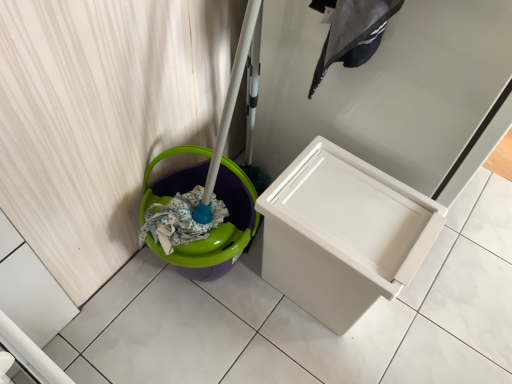
Question: Is white plastic drawer at center to the right of white plastic waste container at center from the viewer's perspective?

Choices:
 (A) yes
 (B) no

Answer: (A)

Question: Is white plastic drawer at center taller than white plastic waste container at center?

Choices:
 (A) no
 (B) yes

Answer: (B)

Question: Is white plastic drawer at center at the left side of white plastic waste container at center?

Choices:
 (A) yes
 (B) no

Answer: (B)

Question: Could you tell me if white plastic drawer at center is turned towards white plastic waste container at center?

Choices:
 (A) yes
 (B) no

Answer: (B)

Question: From a real-world perspective, is white plastic drawer at center positioned under white plastic waste container at center based on gravity?

Choices:
 (A) no
 (B) yes

Answer: (A)

Question: Does white plastic drawer at center have a smaller size compared to white plastic waste container at center?

Choices:
 (A) yes
 (B) no

Answer: (B)

Question: Is white plastic waste container at center bigger than white plastic drawer at center?

Choices:
 (A) no
 (B) yes

Answer: (A)

Question: Considering the relative positions of white plastic waste container at center and white plastic drawer at center in the image provided, is white plastic waste container at center to the left of white plastic drawer at center from the viewer's perspective?

Choices:
 (A) yes
 (B) no

Answer: (A)

Question: Does white plastic waste container at center turn towards white plastic drawer at center?

Choices:
 (A) no
 (B) yes

Answer: (A)

Question: Is white plastic waste container at center smaller than white plastic drawer at center?

Choices:
 (A) yes
 (B) no

Answer: (A)

Question: Is white plastic drawer at center surrounded by white plastic waste container at center?

Choices:
 (A) no
 (B) yes

Answer: (A)

Question: From a real-world perspective, is white plastic waste container at center physically above white plastic drawer at center?

Choices:
 (A) no
 (B) yes

Answer: (A)

Question: Is white plastic waste container at center bigger than dark gray fabric laundry at upper center?

Choices:
 (A) yes
 (B) no

Answer: (A)